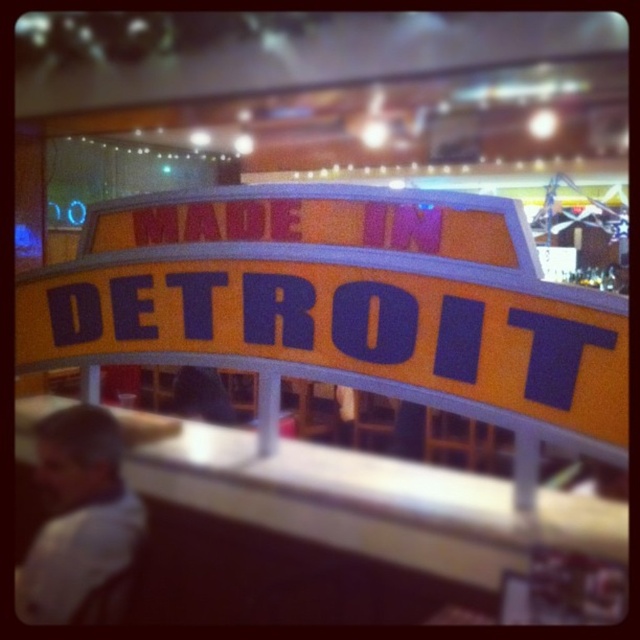
Does yellow matte sign at center appear over white shirt at lower left?

Yes, yellow matte sign at center is above white shirt at lower left.

Is yellow matte sign at center further to the viewer compared to white shirt at lower left?

That is False.

This screenshot has height=640, width=640. Find the location of `yellow matte sign at center`. yellow matte sign at center is located at coordinates (339, 304).

The image size is (640, 640). In order to click on yellow matte sign at center in this screenshot , I will do `click(339, 304)`.